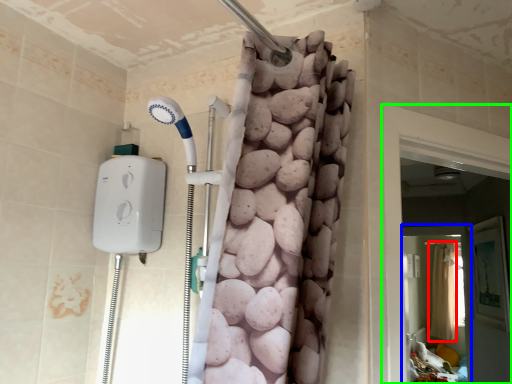
Question: Estimate the real-world distances between objects in this image. Which object is closer to shower curtain (highlighted by a red box), screen door (highlighted by a blue box) or screen door (highlighted by a green box)?

Choices:
 (A) screen door
 (B) screen door

Answer: (A)